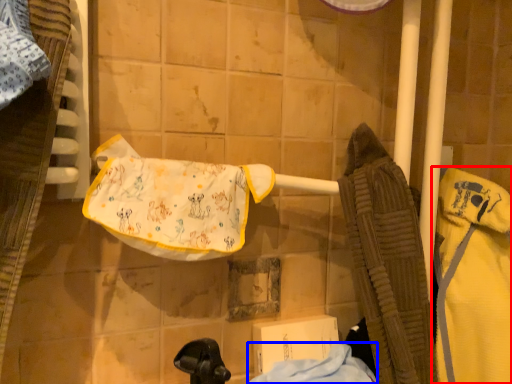
Question: Which of the following is the farthest to the observer, bathrobe (highlighted by a red box) or cloth (highlighted by a blue box)?

Choices:
 (A) bathrobe
 (B) cloth

Answer: (A)